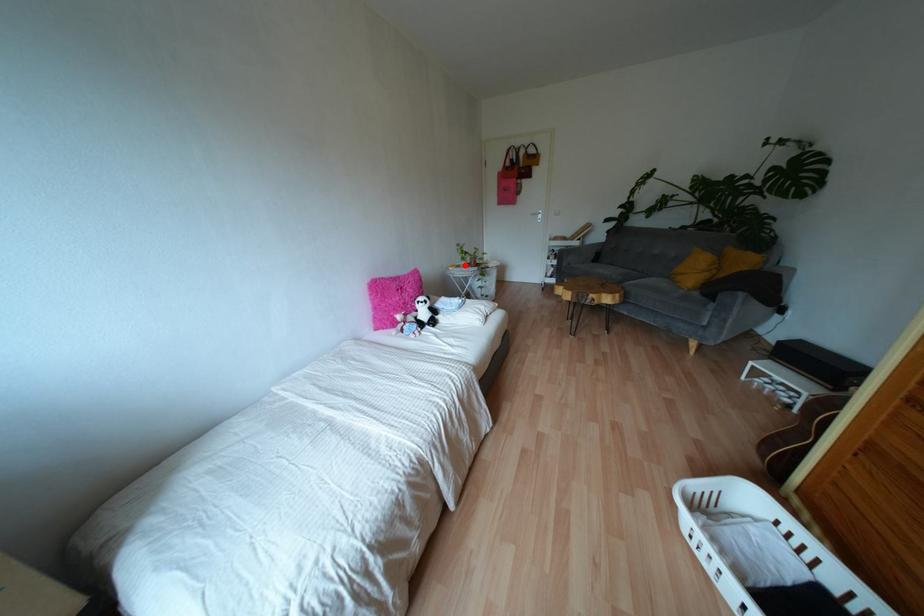
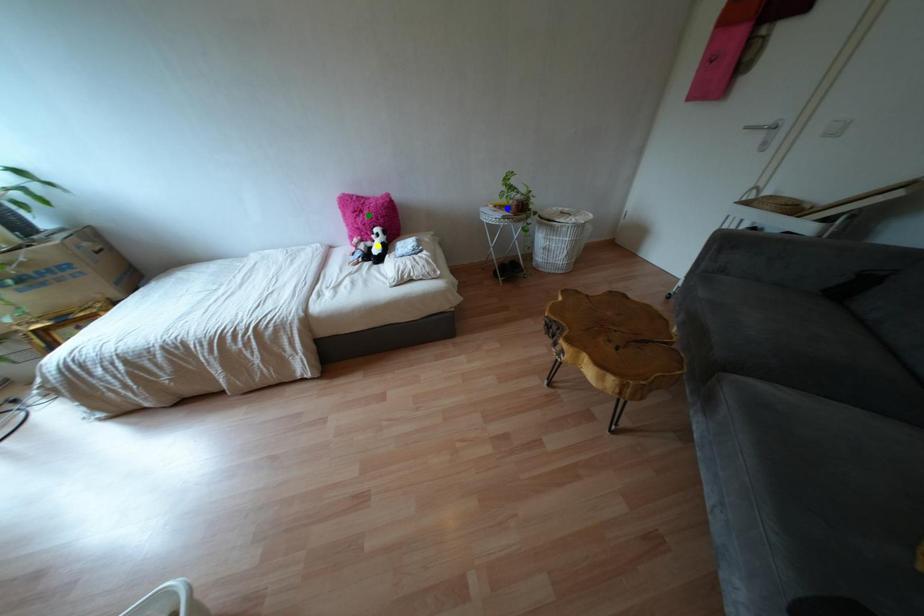
Question: I am providing you with two images of the same scene from different viewpoints. A red point is marked on the first image. You are given multiple points on the second image. Which point in image 2 is actually the same real-world point as the red point in image 1?

Choices:
 (A) green point
 (B) yellow point
 (C) blue point

Answer: (C)